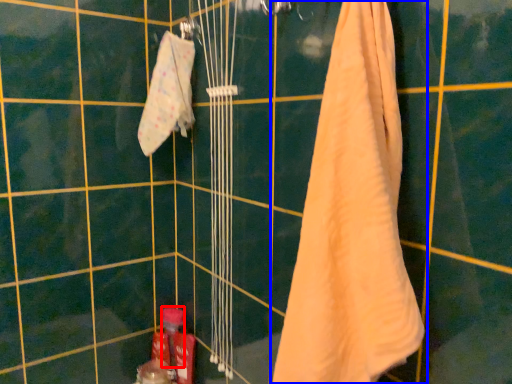
Question: Which point is further to the camera, toiletry (highlighted by a red box) or towel (highlighted by a blue box)?

Choices:
 (A) toiletry
 (B) towel

Answer: (A)